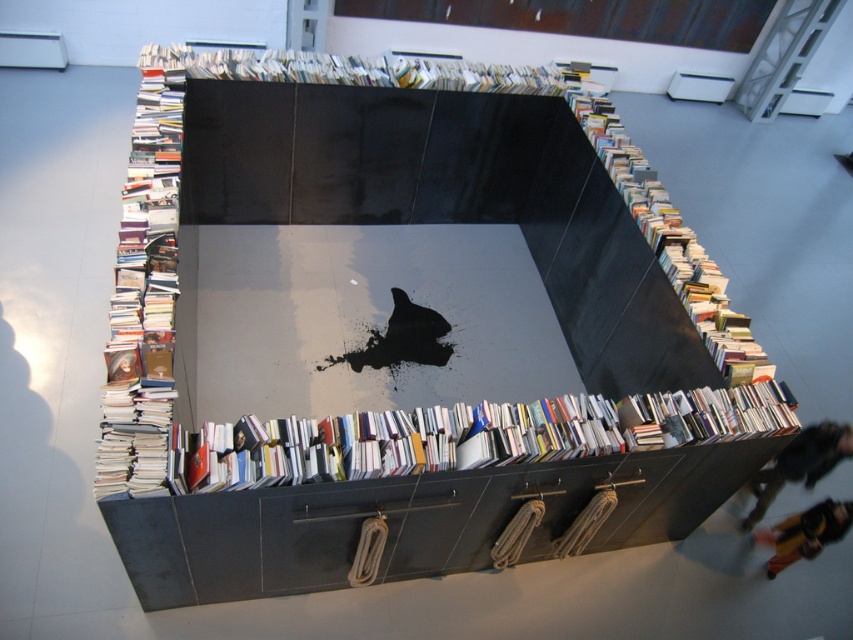
Is point (300, 534) farther from viewer compared to point (824, 465)?

No, it is not.

Find the location of a particular element. This screenshot has height=640, width=853. glossy black bookshelf at center is located at coordinates (425, 406).

The image size is (853, 640). I want to click on glossy black bookshelf at center, so click(425, 406).

Is yellow fabric person at lower right smaller than yellow-orange pants at lower right?

Indeed, yellow fabric person at lower right has a smaller size compared to yellow-orange pants at lower right.

Who is more distant from viewer, (x=848, y=444) or (x=804, y=552)?

Point (x=848, y=444)

Between point (810, 465) and point (830, 515), which one is positioned behind?

The point (810, 465) is more distant.

Locate an element on the screen. yellow fabric person at lower right is located at coordinates (799, 465).

Is glossy black bookshelf at center above yellow-orange pants at lower right?

Correct, glossy black bookshelf at center is located above yellow-orange pants at lower right.

Is point (329, 577) in front of point (793, 531)?

Yes, point (329, 577) is in front of point (793, 531).

What do you see at coordinates (425, 406) in the screenshot? This screenshot has height=640, width=853. I see `glossy black bookshelf at center` at bounding box center [425, 406].

You are a GUI agent. You are given a task and a screenshot of the screen. Output one action in this format:
    pyautogui.click(x=<x>, y=<y>)
    Task: Click on the glossy black bookshelf at center
    
    Given the screenshot: What is the action you would take?
    pyautogui.click(x=425, y=406)